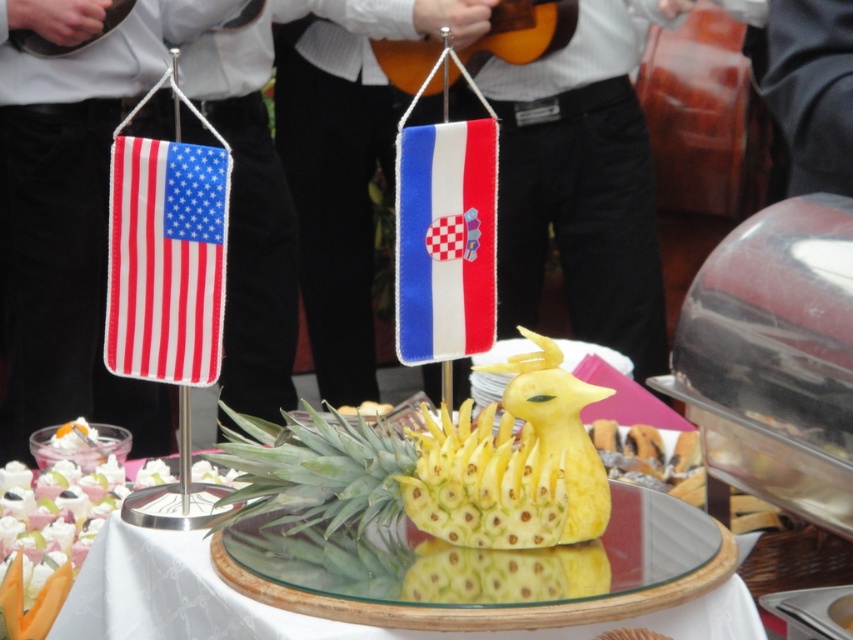
Is white shirt at upper center taller than yellow textured pineapple at center?

Yes, white shirt at upper center is taller than yellow textured pineapple at center.

Locate an element on the screen. Image resolution: width=853 pixels, height=640 pixels. white shirt at upper center is located at coordinates (277, 172).

Can you confirm if white shirt at upper center is wider than green leafy pineapple at center?

Yes, white shirt at upper center is wider than green leafy pineapple at center.

What do you see at coordinates (277, 172) in the screenshot? I see `white shirt at upper center` at bounding box center [277, 172].

Image resolution: width=853 pixels, height=640 pixels. Find the location of `white shirt at upper center`. white shirt at upper center is located at coordinates point(277,172).

Between green leafy pineapple at center and blue felt flag at center, which one appears on the right side from the viewer's perspective?

blue felt flag at center

Which is behind, point (149, 612) or point (434, 163)?

Positioned behind is point (434, 163).

Locate an element on the screen. The width and height of the screenshot is (853, 640). green leafy pineapple at center is located at coordinates (x=303, y=612).